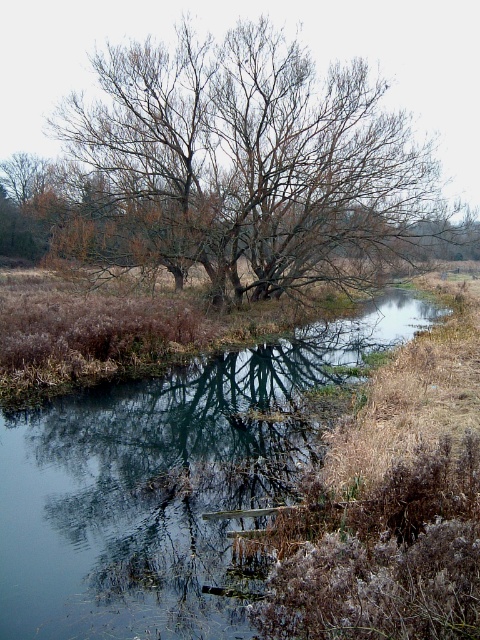
You are standing in the serene natural scene and want to place a small floating decoration on the water near the smooth reflective water at center and the bare branches tree at center. Which object should you approach first to place the decoration closer to the viewer?

You should place the decoration near the smooth reflective water at center first because it is closer to the viewer compared to the bare branches tree at center.

You are standing in the scene and want to locate the smooth reflective water at center. According to the coordinates given, where should you look?

The smooth reflective water at center is located at the coordinates point (x=164, y=484).